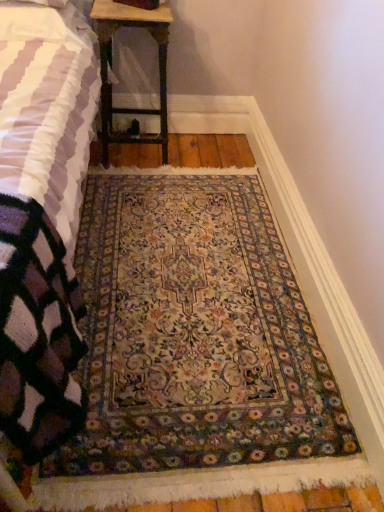
Question: Looking at the image, does knitted wool blanket at lower left seem bigger or smaller compared to carpeted rug at center?

Choices:
 (A) small
 (B) big

Answer: (B)

Question: From their relative heights in the image, would you say knitted wool blanket at lower left is taller or shorter than carpeted rug at center?

Choices:
 (A) short
 (B) tall

Answer: (B)

Question: Which is nearer to the knitted wool blanket at lower left?

Choices:
 (A) wooden table at upper center
 (B) carpeted rug at center

Answer: (B)

Question: Estimate the real-world distances between objects in this image. Which object is farther from the knitted wool blanket at lower left?

Choices:
 (A) carpeted rug at center
 (B) wooden table at upper center

Answer: (B)